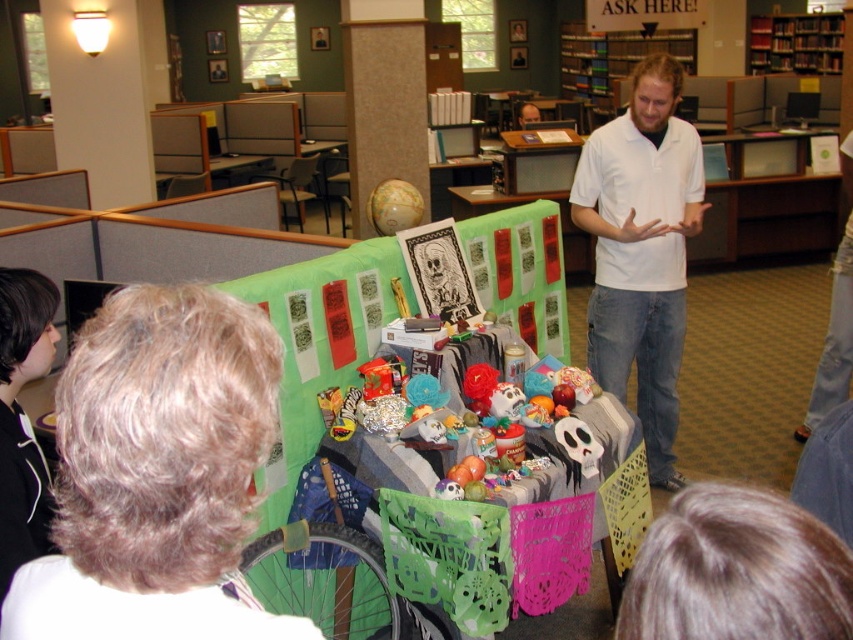
You are standing in the library and need to find the white cotton shirt at center. According to the coordinates provided, where exactly is the white cotton shirt located in the scene?

The white cotton shirt at center is located at coordinates point 0.392 on the x axis and 0.753 on the y axis.

You are a visitor at the library and you see two people in the scene. One has blonde hair at upper left and the other is wearing a black hoodie at lower left. Which person is shorter?

The blonde hair at upper left has a lesser height compared to the black hoodie at lower left, so the person with blonde hair at upper left is shorter.